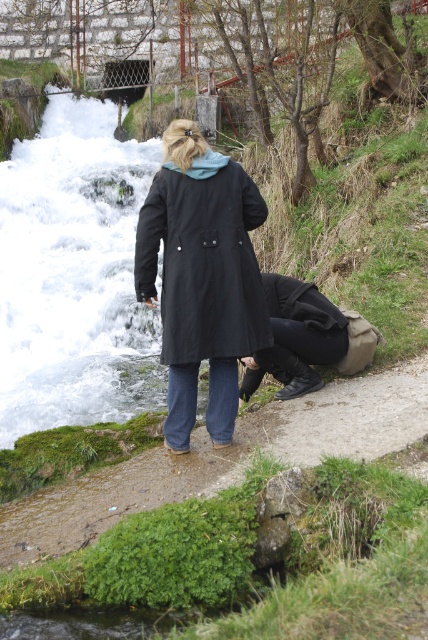
You are a hiker carrying a backpack and want to place your black fabric bag at lower center on the mossy concrete path at lower center. Can you do this without the bag falling off the path?

The mossy concrete path at lower center is not as tall as the black fabric bag at lower center, so the bag will not fit on the path because it is taller than the path itself.

You are a hiker preparing to cross the stream. You notice the black matte coat at center and the black fabric bag at lower center. Which item is more likely to get wet first if you step into the water?

The black fabric bag at lower center is larger than the black matte coat at center, so it is more likely to get wet first when stepping into the water.

You are a hiker trying to cross the stream safely. You see the mossy concrete path at lower center and the black matte coat at center. Which object is located lower in the scene?

The mossy concrete path at lower center is located below the black matte coat at center, so it is lower in the scene.